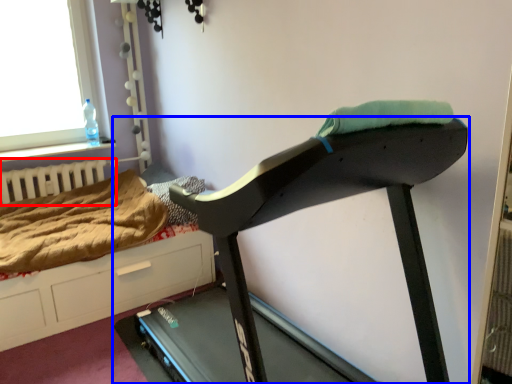
Question: Which point is further to the camera, radiator (highlighted by a red box) or treadmill (highlighted by a blue box)?

Choices:
 (A) radiator
 (B) treadmill

Answer: (A)